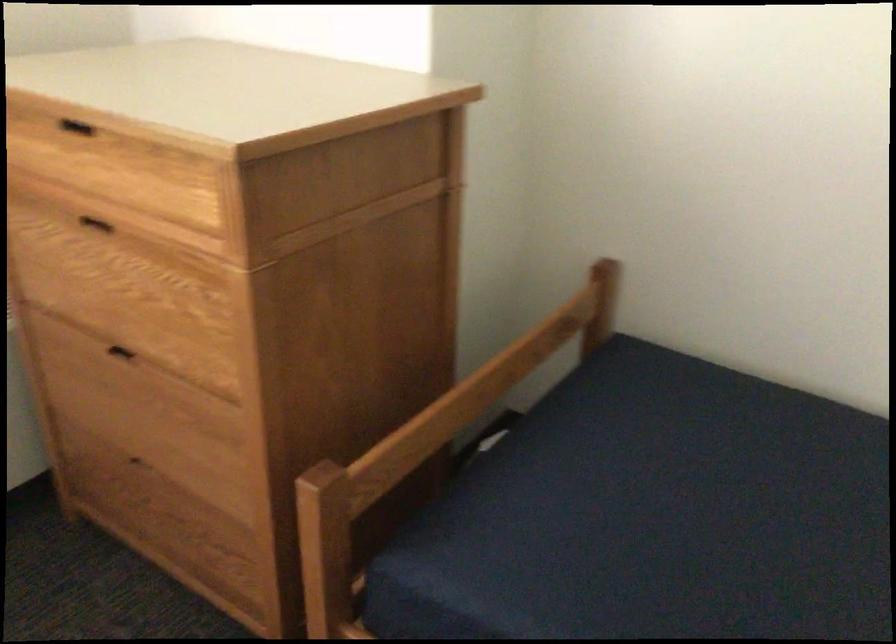
Identify the location of blue sofa sitting surface. (653, 516).